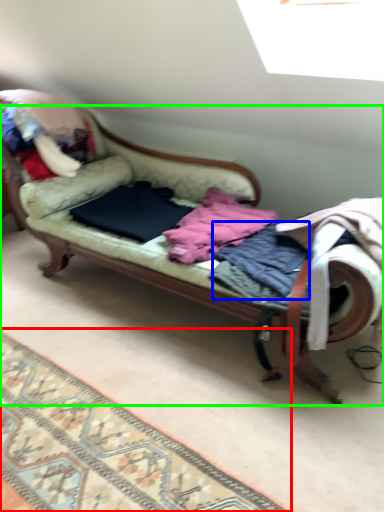
Question: Which is nearer to the mat (highlighted by a red box)? clothing (highlighted by a blue box) or studio couch (highlighted by a green box).

Choices:
 (A) clothing
 (B) studio couch

Answer: (B)